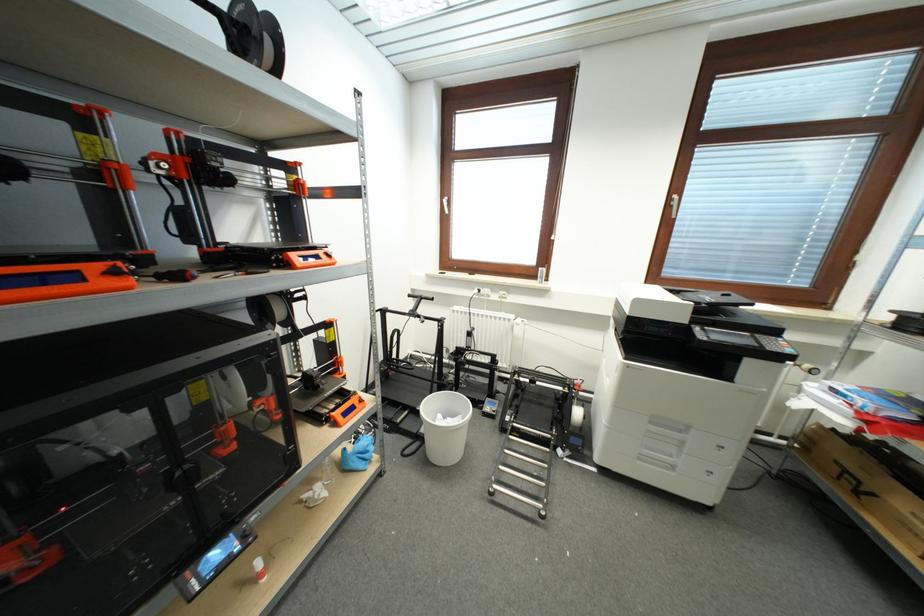
This screenshot has height=616, width=924. Find the location of `printer tray handle`. printer tray handle is located at coordinates (667, 427).